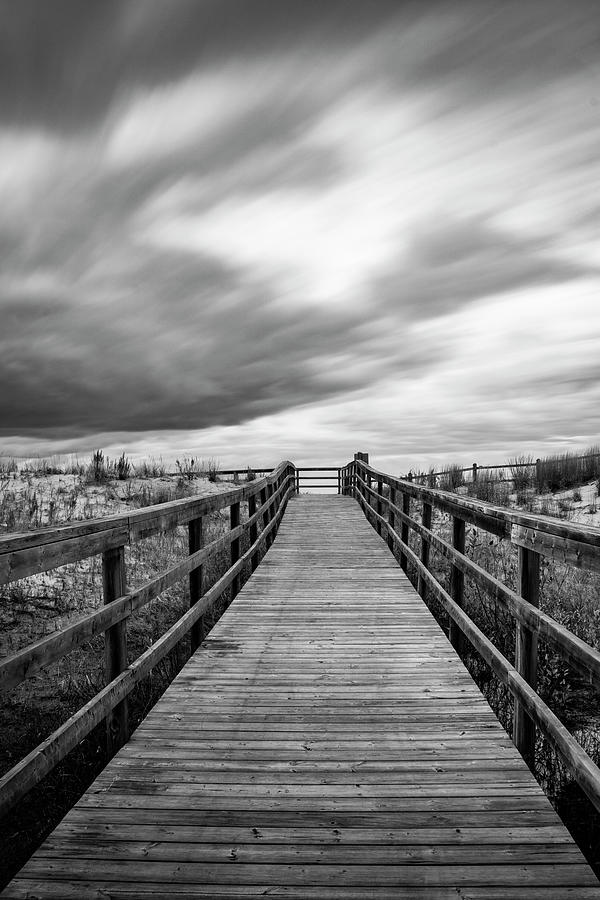
Where is `wooden railing`? The height and width of the screenshot is (900, 600). wooden railing is located at coordinates (148, 517), (466, 517), (237, 474), (475, 469).